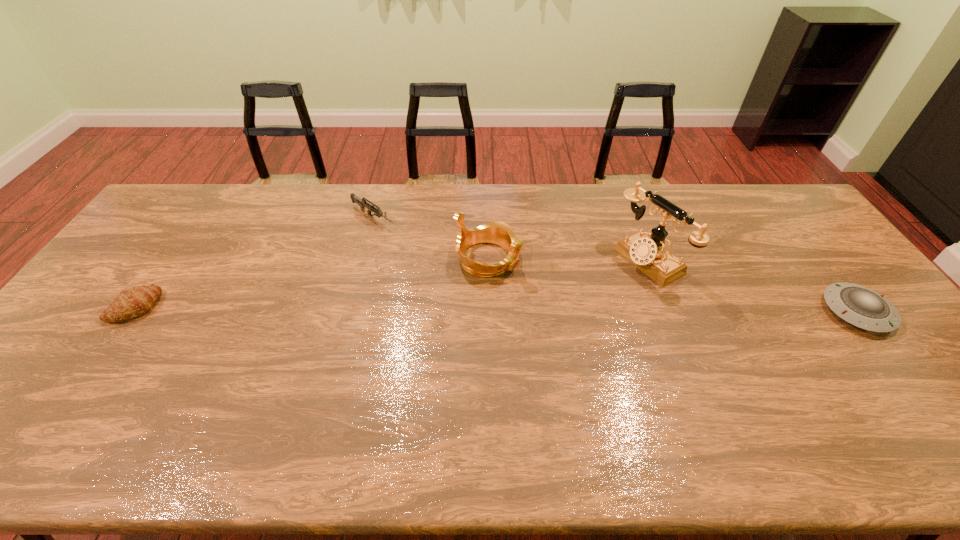
Where is `the leftmost object`? the leftmost object is located at coordinates (134, 302).

You are a GUI agent. You are given a task and a screenshot of the screen. Output one action in this format:
    pyautogui.click(x=<x>, y=<y>)
    Task: Click on the saucer
    This screenshot has height=540, width=960.
    Given the screenshot: What is the action you would take?
    pyautogui.click(x=858, y=305)

This screenshot has height=540, width=960. I want to click on the rightmost object, so click(858, 305).

Where is `the farthest object`? Image resolution: width=960 pixels, height=540 pixels. the farthest object is located at coordinates (362, 203).

You are a GUI agent. You are given a task and a screenshot of the screen. Output one action in this format:
    pyautogui.click(x=<x>, y=<y>)
    Task: Click on the gun
    
    Given the screenshot: What is the action you would take?
    pyautogui.click(x=362, y=203)

This screenshot has height=540, width=960. In order to click on tiara in this screenshot , I will do `click(499, 233)`.

Where is `the third object from right to left`? This screenshot has width=960, height=540. the third object from right to left is located at coordinates (499, 233).

The height and width of the screenshot is (540, 960). What are the coordinates of `the fourth object from left to right` in the screenshot? It's located at (649, 255).

You are a GUI agent. You are given a task and a screenshot of the screen. Output one action in this format:
    pyautogui.click(x=<x>, y=<y>)
    Task: Click on the tallest object
    
    Given the screenshot: What is the action you would take?
    pyautogui.click(x=649, y=255)

Find the location of a particular element. This screenshot has height=540, width=960. blank space located 0.290m on the back of the crescent roll is located at coordinates (192, 225).